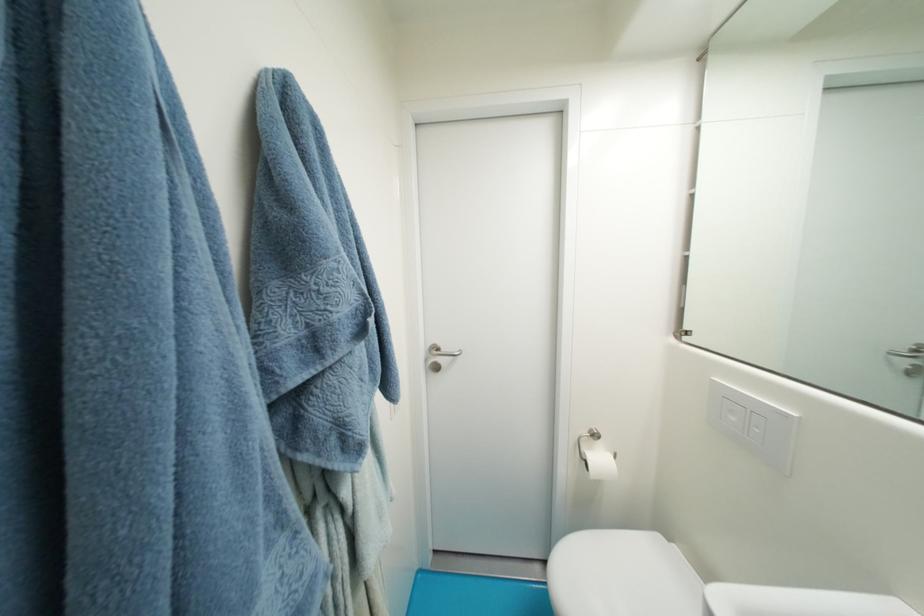
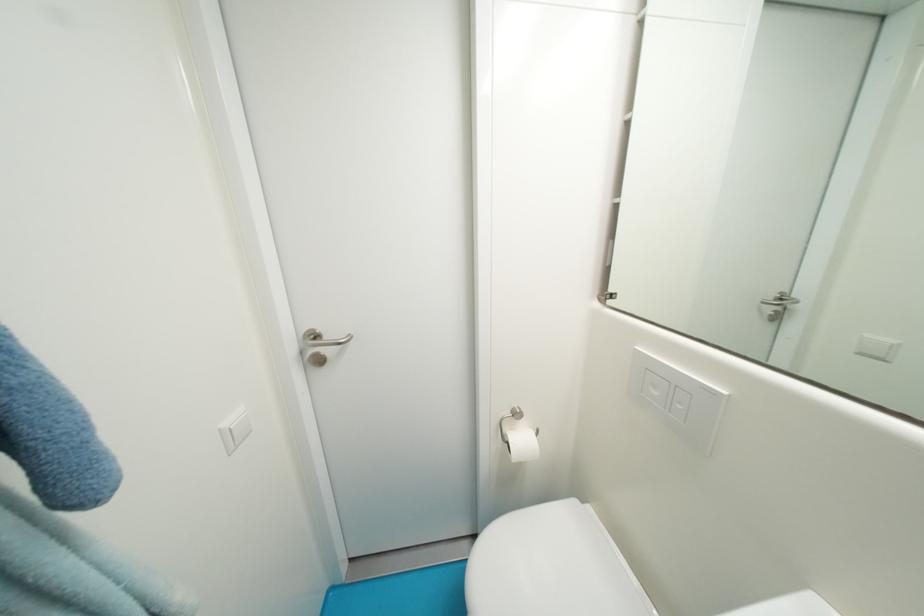
The point at (738,421) is marked in the first image. Where is the corresponding point in the second image?

(662, 395)